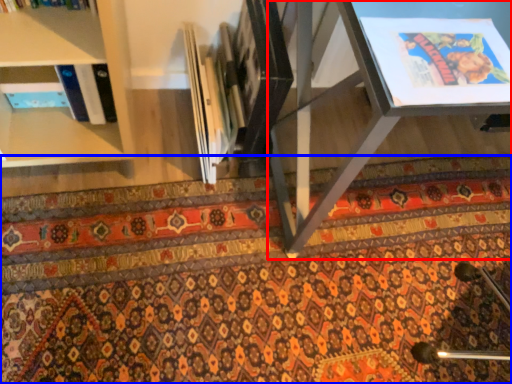
Question: Which object is closer to the camera taking this photo, table (highlighted by a red box) or mat (highlighted by a blue box)?

Choices:
 (A) table
 (B) mat

Answer: (A)